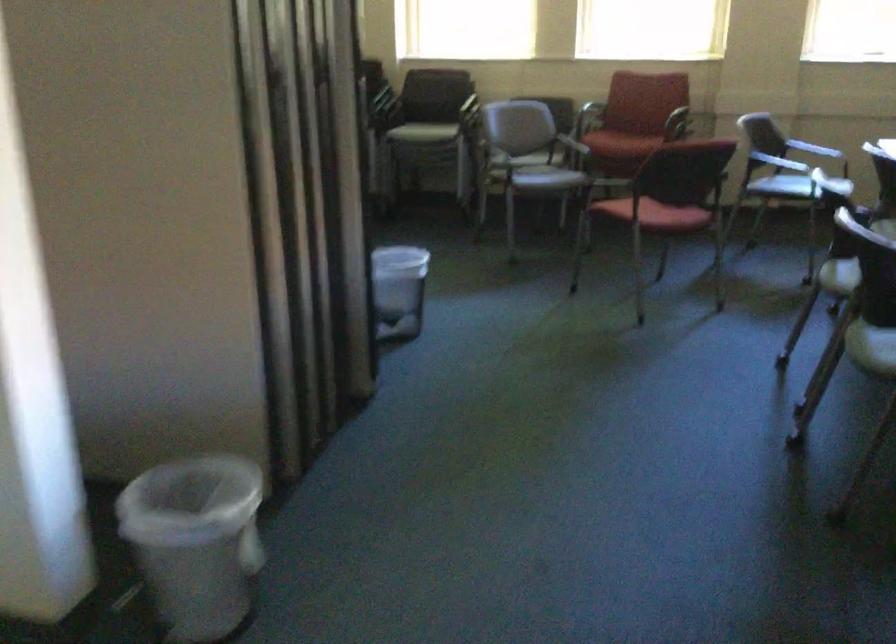
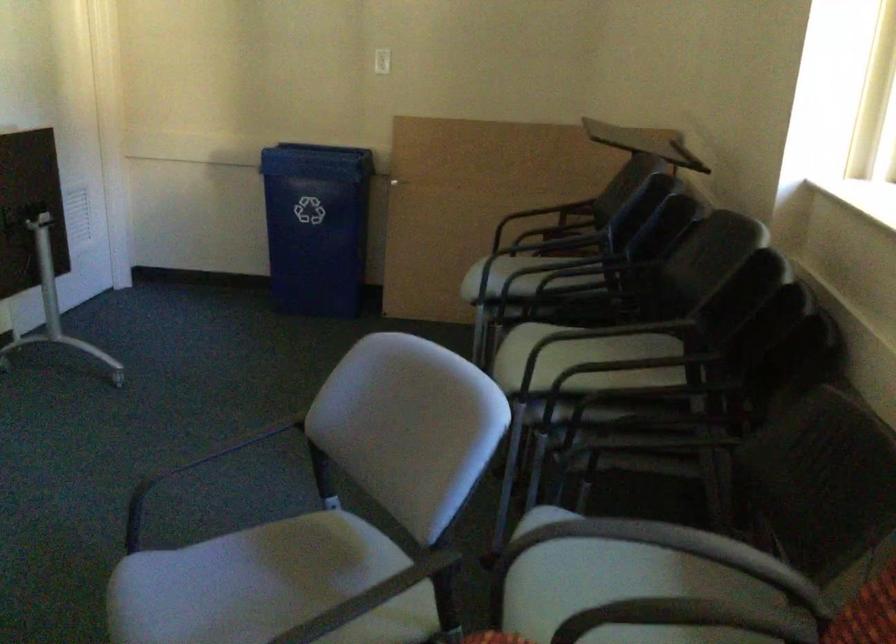
Question: I am providing you with two images of the same scene from different viewpoints. After the viewpoint changes to image2, which objects are now occluded?

Choices:
 (A) black chair armrest
 (B) blue recycling bin
 (C) chair sitting surface
 (D) none of these

Answer: (D)